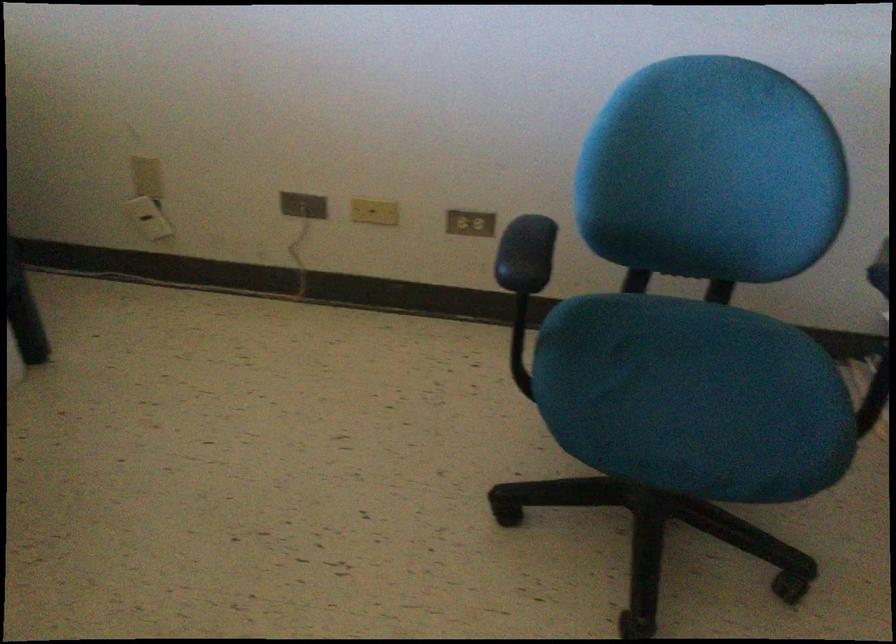
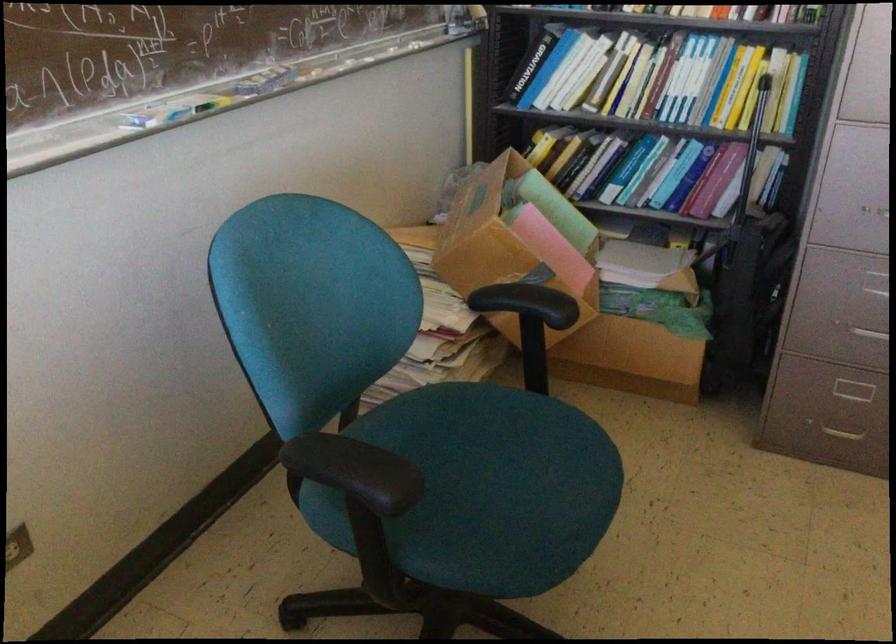
The point at [714,384] is marked in the first image. Where is the corresponding point in the second image?

(498, 458)